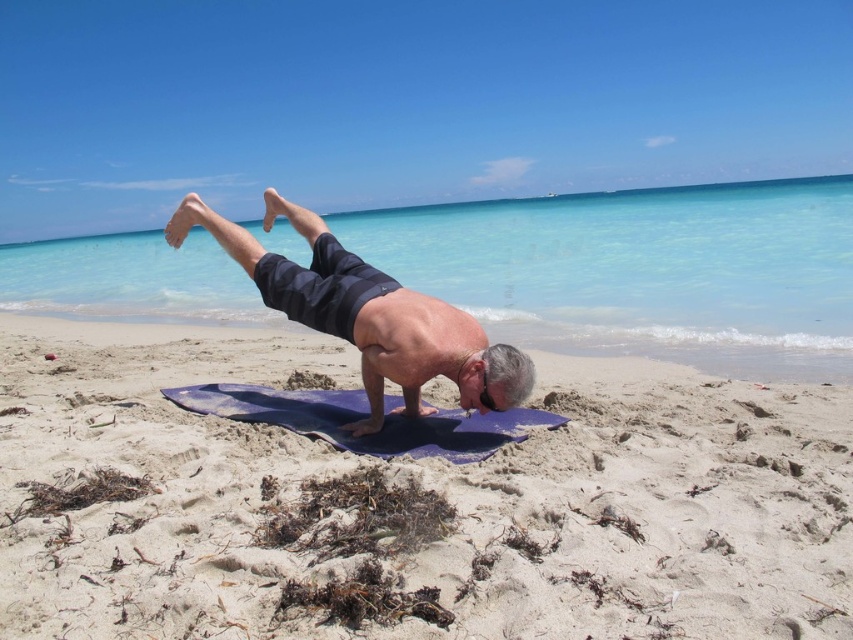
Question: Among these objects, which one is nearest to the camera?

Choices:
 (A) purple rubber mat at center
 (B) white sandy beach at center

Answer: (B)

Question: Which point is farther to the camera?

Choices:
 (A) purple rubber mat at center
 (B) matte black yoga mat at center

Answer: (A)

Question: Which object is the farthest from the purple rubber mat at center?

Choices:
 (A) white sandy beach at center
 (B) matte black yoga mat at center

Answer: (A)

Question: Considering the relative positions of white sandy beach at center and matte black yoga mat at center in the image provided, where is white sandy beach at center located with respect to matte black yoga mat at center?

Choices:
 (A) above
 (B) below

Answer: (B)

Question: Is white sandy beach at center positioned behind matte black yoga mat at center?

Choices:
 (A) no
 (B) yes

Answer: (A)

Question: Does white sandy beach at center have a larger size compared to purple rubber mat at center?

Choices:
 (A) no
 (B) yes

Answer: (A)